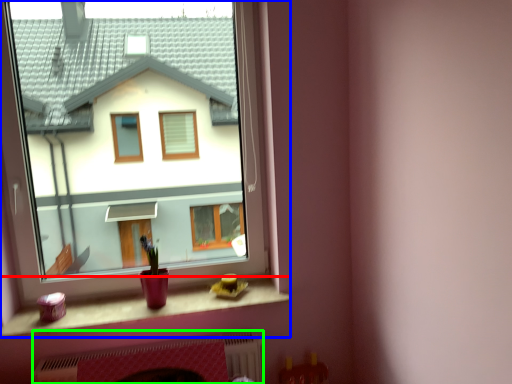
Question: Considering the real-world distances, which object is farthest from window sill (highlighted by a red box)? window (highlighted by a blue box) or fireplace (highlighted by a green box)?

Choices:
 (A) window
 (B) fireplace

Answer: (A)